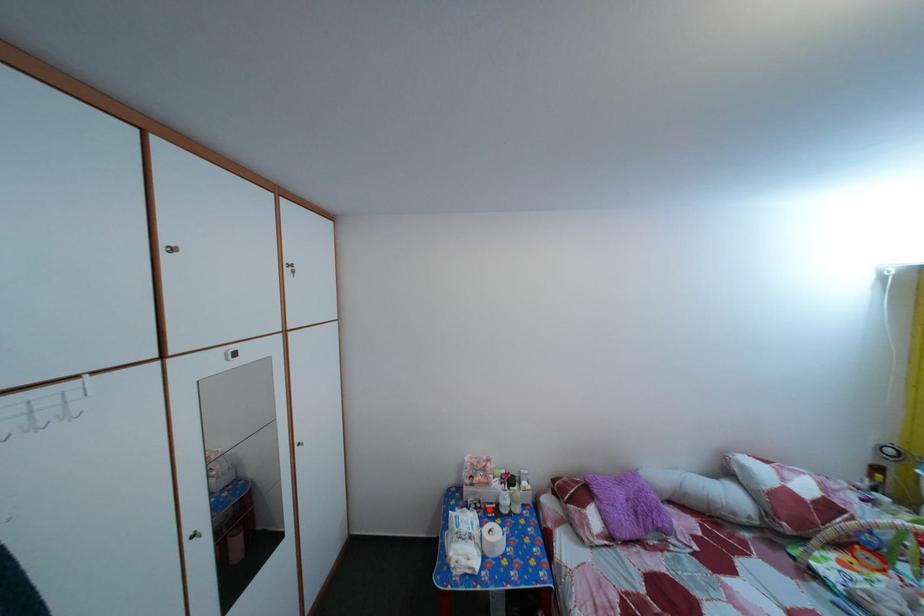
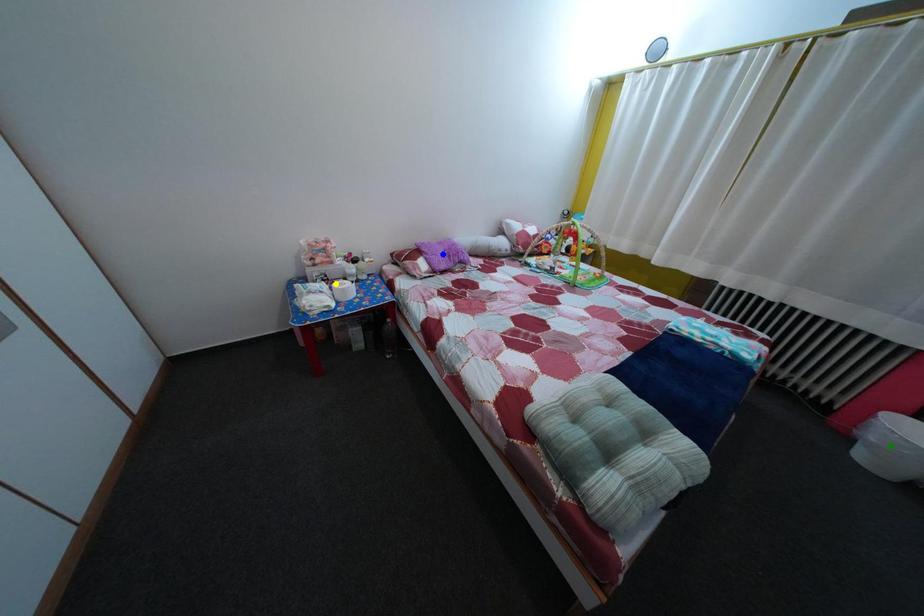
Question: I am providing you with two images of the same scene from different viewpoints. A red point is marked on the first image. You are given multiple points on the second image. Which mark in image 2 goes with the point in image 1?

Choices:
 (A) green point
 (B) yellow point
 (C) blue point

Answer: (B)